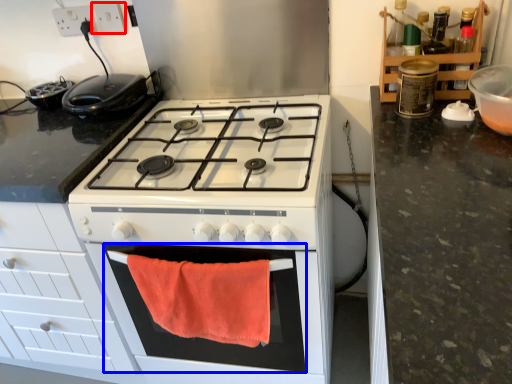
Question: Which point is further to the camera, electric outlet (highlighted by a red box) or oven (highlighted by a blue box)?

Choices:
 (A) electric outlet
 (B) oven

Answer: (A)